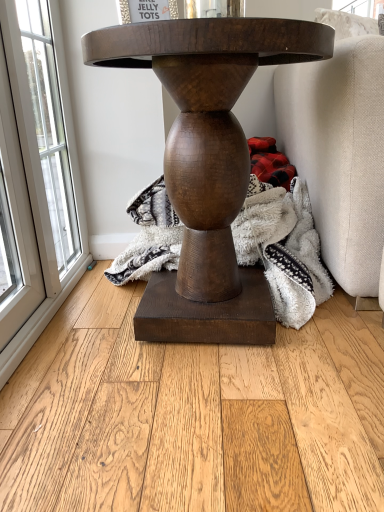
Question: From a real-world perspective, is fuzzy white blanket at center positioned over red plaid fabric at lower right based on gravity?

Choices:
 (A) no
 (B) yes

Answer: (A)

Question: Can you confirm if fuzzy white blanket at center is taller than red plaid fabric at lower right?

Choices:
 (A) no
 (B) yes

Answer: (B)

Question: From a real-world perspective, is fuzzy white blanket at center beneath red plaid fabric at lower right?

Choices:
 (A) yes
 (B) no

Answer: (A)

Question: Does fuzzy white blanket at center appear on the right side of red plaid fabric at lower right?

Choices:
 (A) no
 (B) yes

Answer: (A)

Question: Can you confirm if fuzzy white blanket at center is thinner than red plaid fabric at lower right?

Choices:
 (A) yes
 (B) no

Answer: (B)

Question: Visually, is red plaid fabric at lower right positioned to the left or to the right of clear glass window at left?

Choices:
 (A) left
 (B) right

Answer: (B)

Question: Is point (283, 165) closer or farther from the camera than point (29, 178)?

Choices:
 (A) farther
 (B) closer

Answer: (A)

Question: Which is correct: red plaid fabric at lower right is inside clear glass window at left, or outside of it?

Choices:
 (A) outside
 (B) inside

Answer: (A)

Question: Considering their positions, is red plaid fabric at lower right located in front of or behind clear glass window at left?

Choices:
 (A) behind
 (B) front

Answer: (A)

Question: In terms of width, does natural wood flooring at center look wider or thinner when compared to clear glass window at left?

Choices:
 (A) thin
 (B) wide

Answer: (B)

Question: From the image's perspective, is natural wood flooring at center positioned above or below clear glass window at left?

Choices:
 (A) above
 (B) below

Answer: (B)

Question: Is natural wood flooring at center bigger or smaller than clear glass window at left?

Choices:
 (A) small
 (B) big

Answer: (B)

Question: Relative to clear glass window at left, is natural wood flooring at center in front or behind?

Choices:
 (A) front
 (B) behind

Answer: (A)

Question: Is point (240, 88) closer or farther from the camera than point (134, 374)?

Choices:
 (A) closer
 (B) farther

Answer: (B)

Question: In the image, is matte brown wooden table at center positioned in front of or behind natural wood flooring at center?

Choices:
 (A) behind
 (B) front

Answer: (A)